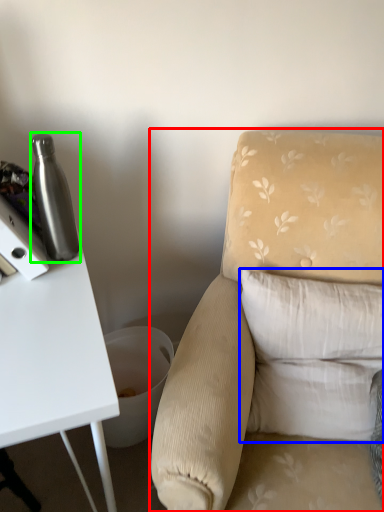
Question: Considering the real-world distances, which object is farthest from chair (highlighted by a red box)? pillow (highlighted by a blue box) or bottle (highlighted by a green box)?

Choices:
 (A) pillow
 (B) bottle

Answer: (B)